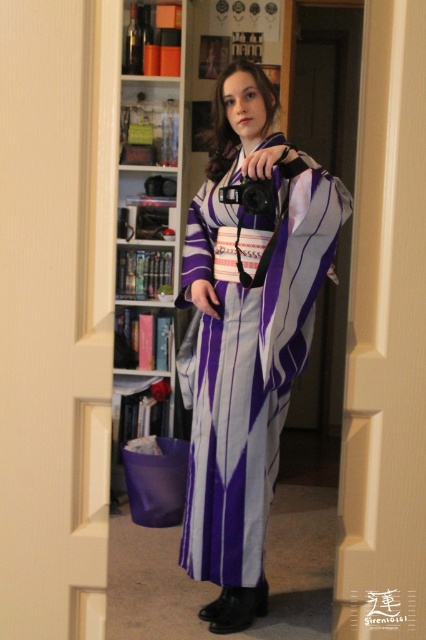
Question: Which object appears closest to the camera in this image?

Choices:
 (A) purple silk kimono at center
 (B) black plastic camera at center

Answer: (A)

Question: In this image, where is purple silk kimono at center located relative to black plastic camera at center?

Choices:
 (A) below
 (B) above

Answer: (A)

Question: Does white wooden bookshelf at center appear on the left side of black plastic camera at center?

Choices:
 (A) yes
 (B) no

Answer: (A)

Question: Estimate the real-world distances between objects in this image. Which object is closer to the white wooden bookshelf at center?

Choices:
 (A) black plastic camera at center
 (B) purple silk kimono at center

Answer: (B)

Question: Where is white wooden bookshelf at center located in relation to black plastic camera at center in the image?

Choices:
 (A) below
 (B) above

Answer: (B)

Question: Which point appears farthest from the camera in this image?

Choices:
 (A) (134, 404)
 (B) (244, 177)
 (C) (242, 621)

Answer: (A)